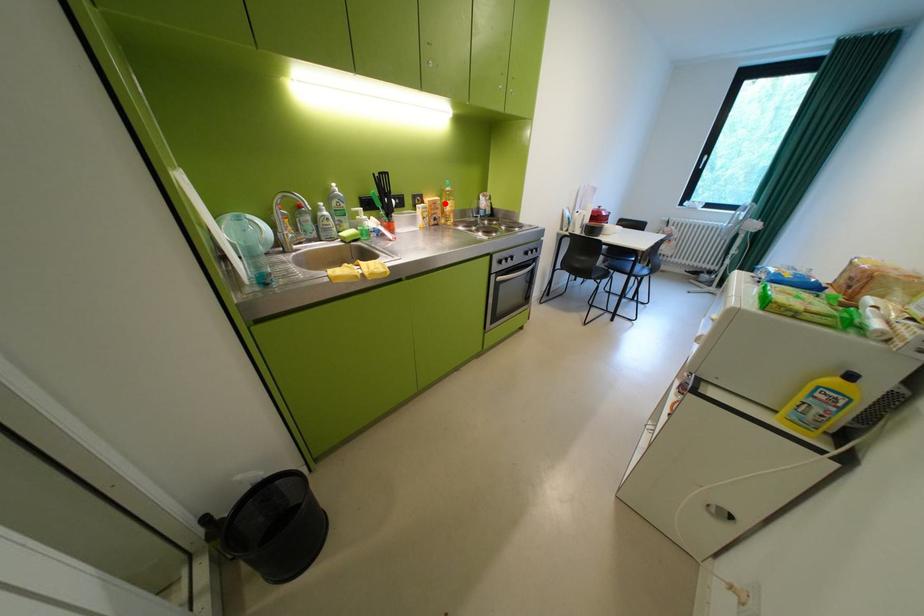
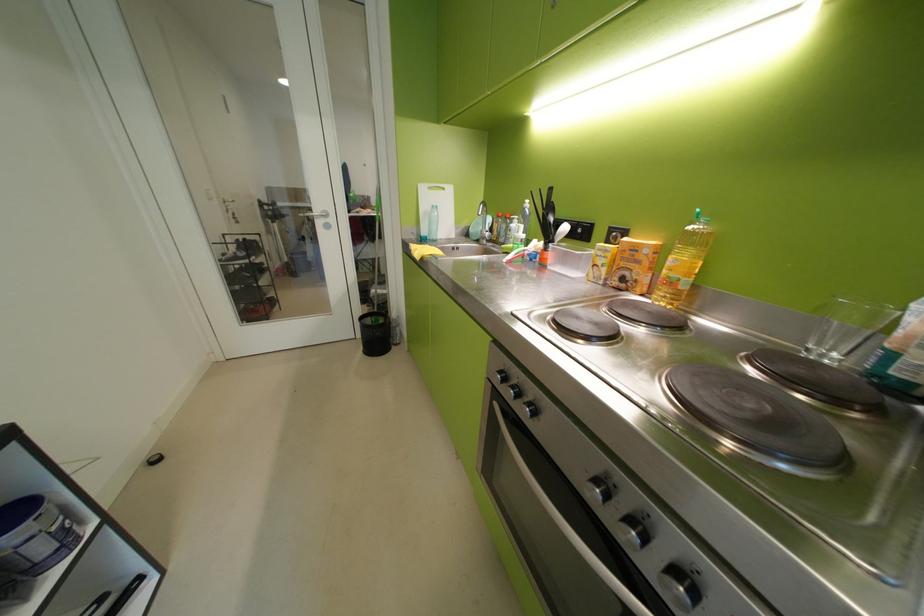
Question: I am providing you with two images of the same scene from different viewpoints. A red point is marked on the first image. Can you still see the location of the red point in image 2?

Choices:
 (A) Yes
 (B) No

Answer: (A)